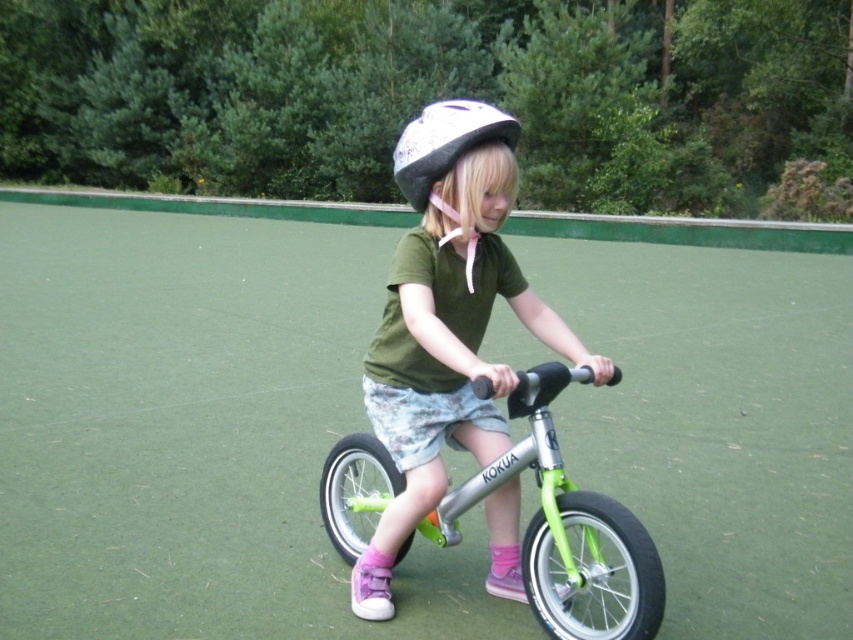
Identify the location of matte silver helmet at center. (445, 321).

Who is more forward, (x=427, y=284) or (x=344, y=506)?

Positioned in front is point (x=427, y=284).

Where is `matte silver helmet at center`? matte silver helmet at center is located at coordinates (445, 321).

Does green metallic bicycle at center lie behind white matte helmet at center?

No, it is in front of white matte helmet at center.

The image size is (853, 640). What are the coordinates of `green metallic bicycle at center` in the screenshot? It's located at (566, 531).

Find the location of a particular element. This screenshot has height=640, width=853. green metallic bicycle at center is located at coordinates (566, 531).

Consider the image. Can you confirm if matte silver helmet at center is smaller than white matte helmet at center?

Correct, matte silver helmet at center occupies less space than white matte helmet at center.

Based on the photo, does matte silver helmet at center have a greater width compared to white matte helmet at center?

No.

This screenshot has height=640, width=853. What do you see at coordinates (445, 321) in the screenshot?
I see `matte silver helmet at center` at bounding box center [445, 321].

Where is `matte silver helmet at center`? The width and height of the screenshot is (853, 640). matte silver helmet at center is located at coordinates (445, 321).